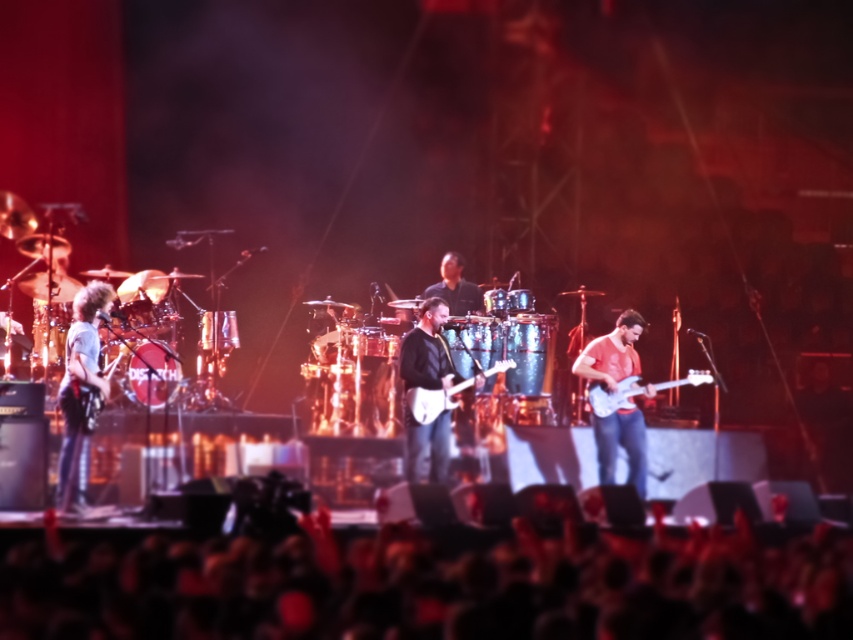
Question: Is light blue denim shirt at left closer to camera compared to shiny silver guitar at right?

Choices:
 (A) no
 (B) yes

Answer: (B)

Question: Among these objects, which one is nearest to the camera?

Choices:
 (A) shiny black electric guitar at center
 (B) black matte guitar at center
 (C) light blue denim shirt at left
 (D) black leather jacket at center

Answer: (C)

Question: Which object is positioned farthest from the white glossy electric guitar at right?

Choices:
 (A) black matte guitar at center
 (B) shiny black electric guitar at center
 (C) black fabric at lower center

Answer: (C)

Question: Which object appears closest to the camera in this image?

Choices:
 (A) black matte guitar at center
 (B) black fabric at lower center
 (C) shiny black electric guitar at center

Answer: (B)

Question: Does black fabric at lower center appear under white glossy electric guitar at right?

Choices:
 (A) yes
 (B) no

Answer: (A)

Question: Is white glossy electric guitar at right positioned in front of shiny black electric guitar at center?

Choices:
 (A) no
 (B) yes

Answer: (A)